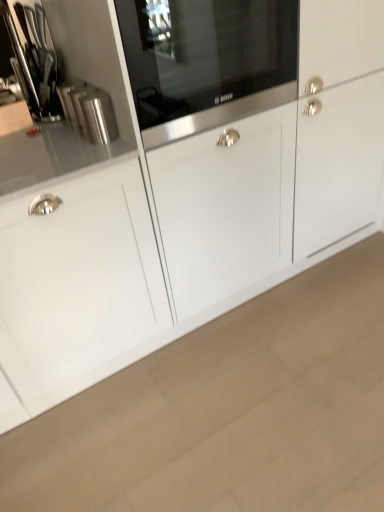
Question: From a real-world perspective, is polished stainless steel knife block at upper left physically located above or below stainless steel microwave at center?

Choices:
 (A) below
 (B) above

Answer: (A)

Question: Looking at their shapes, would you say polished stainless steel knife block at upper left is wider or thinner than stainless steel microwave at center?

Choices:
 (A) wide
 (B) thin

Answer: (B)

Question: Which is nearer to the stainless steel microwave at center?

Choices:
 (A) polished stainless steel canister at left
 (B) polished stainless steel knife block at upper left

Answer: (A)

Question: Based on their relative distances, which object is nearer to the polished stainless steel canister at left?

Choices:
 (A) polished stainless steel knife block at upper left
 (B) stainless steel microwave at center

Answer: (A)